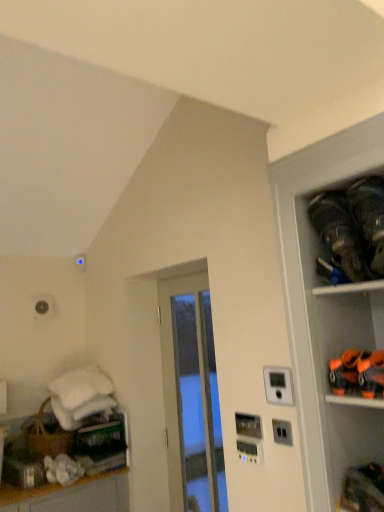
Question: Is black fabric shoes at upper right inside the boundaries of transparent glass door at center, or outside?

Choices:
 (A) outside
 (B) inside

Answer: (A)

Question: Looking at their shapes, would you say black fabric shoes at upper right is wider or thinner than transparent glass door at center?

Choices:
 (A) wide
 (B) thin

Answer: (A)

Question: Is black fabric shoes at upper right bigger or smaller than transparent glass door at center?

Choices:
 (A) small
 (B) big

Answer: (A)

Question: Is transparent glass door at center situated inside black fabric shoes at upper right or outside?

Choices:
 (A) outside
 (B) inside

Answer: (A)

Question: From the image's perspective, is transparent glass door at center above or below black fabric shoes at upper right?

Choices:
 (A) below
 (B) above

Answer: (A)

Question: Considering the relative positions of transparent glass door at center and black fabric shoes at upper right in the image provided, is transparent glass door at center to the left or to the right of black fabric shoes at upper right?

Choices:
 (A) right
 (B) left

Answer: (B)

Question: Relative to black fabric shoes at upper right, is transparent glass door at center in front or behind?

Choices:
 (A) behind
 (B) front

Answer: (A)